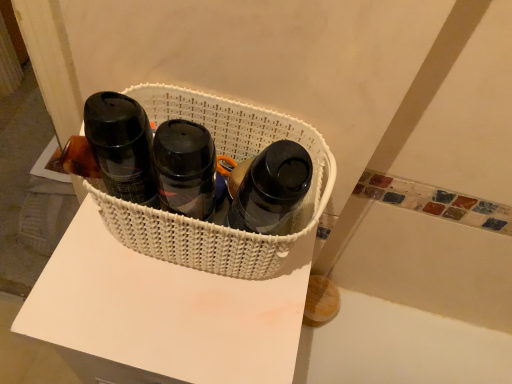
Locate an element on the screen. The image size is (512, 384). free spot in front of white woven basket at center is located at coordinates (167, 319).